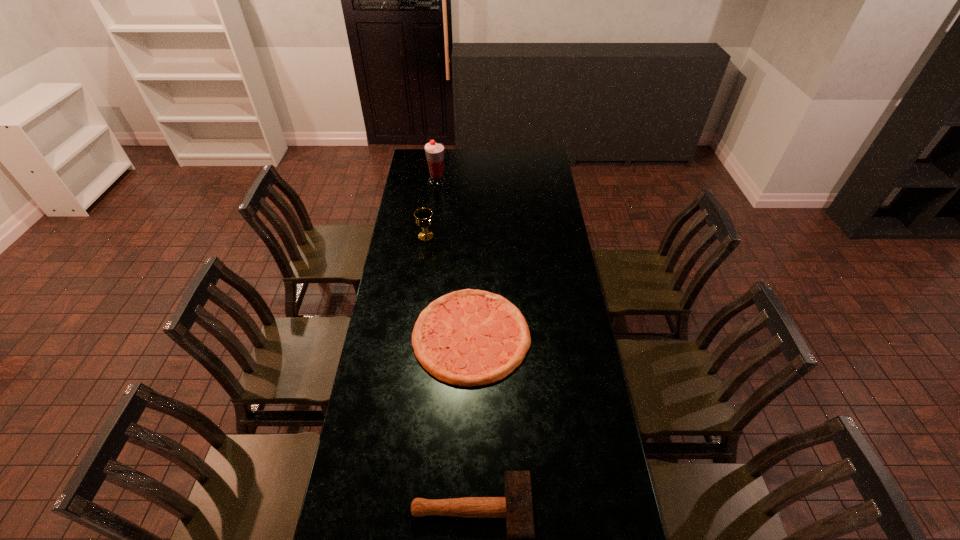
I want to click on chalice located in the left edge section of the desktop, so click(x=423, y=216).

Locate an element on the screen. This screenshot has height=540, width=960. pizza that is at the left edge is located at coordinates (469, 337).

In the image, there is a desktop. Where is `vacant space at the far edge`? This screenshot has height=540, width=960. vacant space at the far edge is located at coordinates (466, 150).

Locate an element on the screen. The width and height of the screenshot is (960, 540). vacant space at the left edge of the desktop is located at coordinates (404, 205).

Locate an element on the screen. The width and height of the screenshot is (960, 540). vacant space at the right edge of the desktop is located at coordinates (543, 173).

Locate an element on the screen. free spot at the far right corner of the desktop is located at coordinates (527, 156).

Where is `vacant space that is in between the smoothie and the third shortest object`? The height and width of the screenshot is (540, 960). vacant space that is in between the smoothie and the third shortest object is located at coordinates (431, 209).

You are a GUI agent. You are given a task and a screenshot of the screen. Output one action in this format:
    pyautogui.click(x=<x>, y=<y>)
    Task: Click on the free area in between the tallest object and the third nearest object
    The width and height of the screenshot is (960, 540).
    Given the screenshot: What is the action you would take?
    pyautogui.click(x=431, y=209)

Identify the location of free space between the shortest object and the chalice. (448, 286).

This screenshot has height=540, width=960. In order to click on empty space between the third nearest object and the shortest object in this screenshot , I will do `click(448, 286)`.